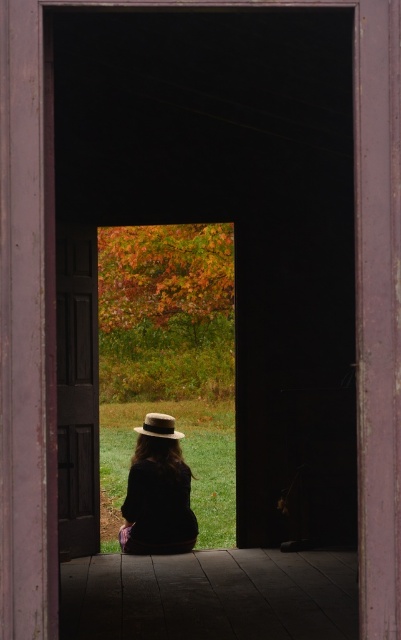
In the scene shown: You are standing in front of the wooden door and see two points marked in the scene. Which point is closer to you, point [153,442] or point [174,436]?

Point [153,442] is in front of point [174,436], so it is closer to you.

You are standing in a room with an open doorway leading to a field. You see a matte black coat at center and a brown felt fedora at center. Which object is closer to the doorway?

The brown felt fedora at center is closer to the doorway because it is above the matte black coat at center, which is positioned below it.

You are standing in a hallway and see the dark wood door at center and the matte black coat at center. Which object is closer to you?

The dark wood door at center is closer to you because it is positioned over the matte black coat at center, indicating it is in front.